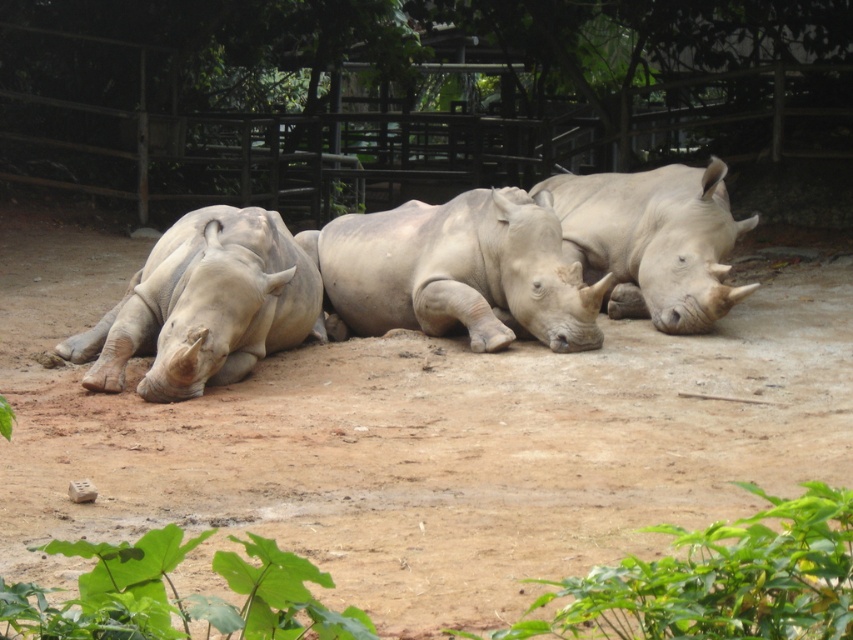
Which is below, gray matte rhinoceros at center or smooth gray rhino at center?

gray matte rhinoceros at center is lower down.

Is gray matte rhinoceros at center smaller than smooth gray rhino at center?

Yes, gray matte rhinoceros at center is smaller than smooth gray rhino at center.

What do you see at coordinates (457, 272) in the screenshot? I see `gray matte rhinoceros at center` at bounding box center [457, 272].

I want to click on gray matte rhinoceros at center, so click(457, 272).

Is gray matte rhinoceros at left below smooth gray rhino at center?

Correct, gray matte rhinoceros at left is located below smooth gray rhino at center.

Where is `gray matte rhinoceros at left`? gray matte rhinoceros at left is located at coordinates (204, 305).

Image resolution: width=853 pixels, height=640 pixels. I want to click on gray matte rhinoceros at left, so click(x=204, y=305).

Describe the element at coordinates (457, 272) in the screenshot. Image resolution: width=853 pixels, height=640 pixels. I see `gray matte rhinoceros at center` at that location.

Which is behind, point (569, 346) or point (247, 212)?

Positioned behind is point (569, 346).

Does point (485, 256) come behind point (73, 353)?

Yes, it is behind point (73, 353).

Find the location of a particular element. The height and width of the screenshot is (640, 853). gray matte rhinoceros at center is located at coordinates (457, 272).